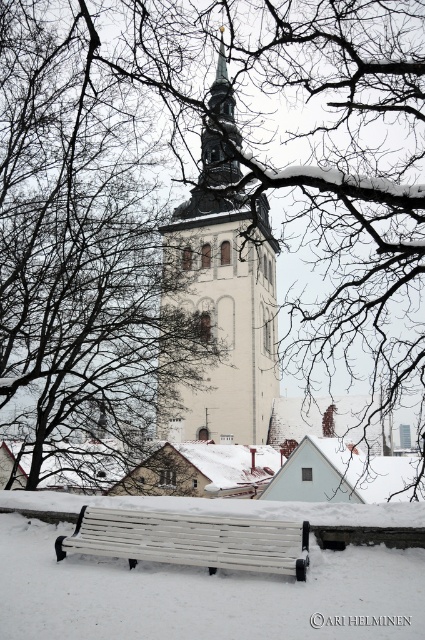
Question: Does gray stone tower at center lie behind white wooden bench at lower center?

Choices:
 (A) no
 (B) yes

Answer: (B)

Question: Is gray stone tower at center bigger than white wooden bench at lower center?

Choices:
 (A) no
 (B) yes

Answer: (B)

Question: Among these points, which one is nearest to the camera?

Choices:
 (A) (235, 355)
 (B) (62, 556)

Answer: (B)

Question: Which point appears farthest from the camera in this image?

Choices:
 (A) (204, 413)
 (B) (167, 554)

Answer: (A)

Question: Which of the following is the farthest from the observer?

Choices:
 (A) white wooden bench at lower center
 (B) gray stone tower at center

Answer: (B)

Question: Does gray stone tower at center appear under white wooden bench at lower center?

Choices:
 (A) yes
 (B) no

Answer: (B)